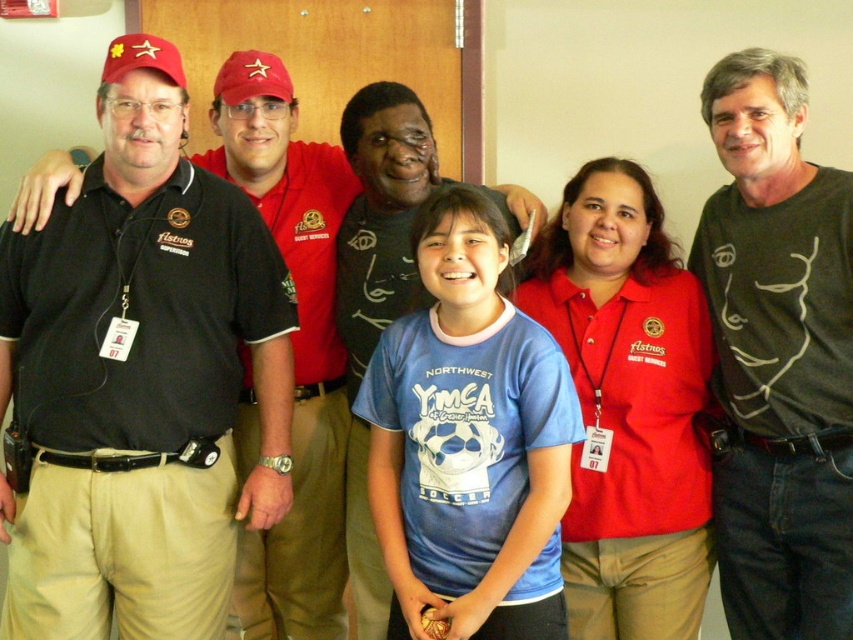
Question: Which object is positioned farthest from the black shirt at left?

Choices:
 (A) blue cotton shirt at center
 (B) red matte shirt at center
 (C) black matte shirt at right

Answer: (C)

Question: From the image, what is the correct spatial relationship of blue cotton shirt at center in relation to red matte shirt at center?

Choices:
 (A) above
 (B) below

Answer: (B)

Question: Estimate the real-world distances between objects in this image. Which object is farther from the black shirt at left?

Choices:
 (A) blue cotton shirt at center
 (B) black matte shirt at right

Answer: (B)

Question: Is black matte shirt at right above red matte shirt at center?

Choices:
 (A) no
 (B) yes

Answer: (B)

Question: Is blue cotton shirt at center below black shirt at left?

Choices:
 (A) no
 (B) yes

Answer: (B)

Question: Which point is closer to the camera taking this photo?

Choices:
 (A) (496, 403)
 (B) (819, 604)

Answer: (A)